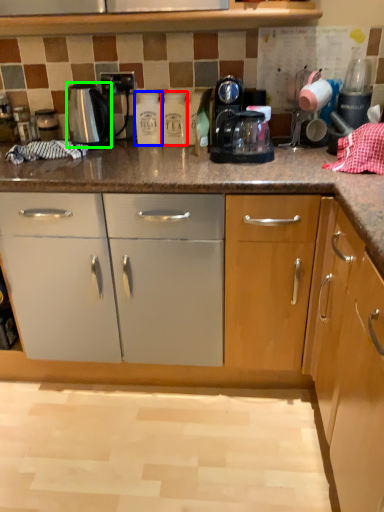
Question: Estimate the real-world distances between objects in this image. Which object is closer to bottle (highlighted by a red box), bottle (highlighted by a blue box) or kitchen appliance (highlighted by a green box)?

Choices:
 (A) bottle
 (B) kitchen appliance

Answer: (A)